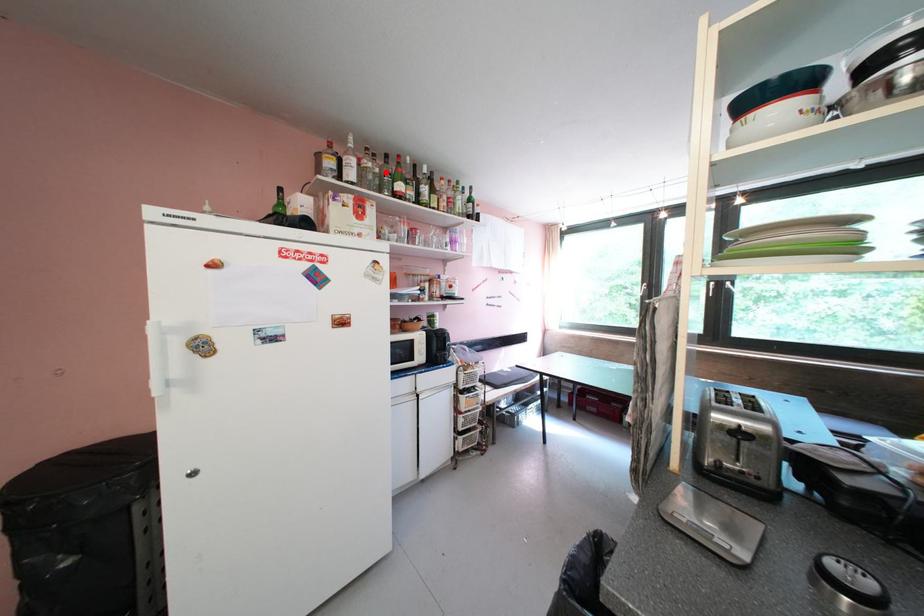
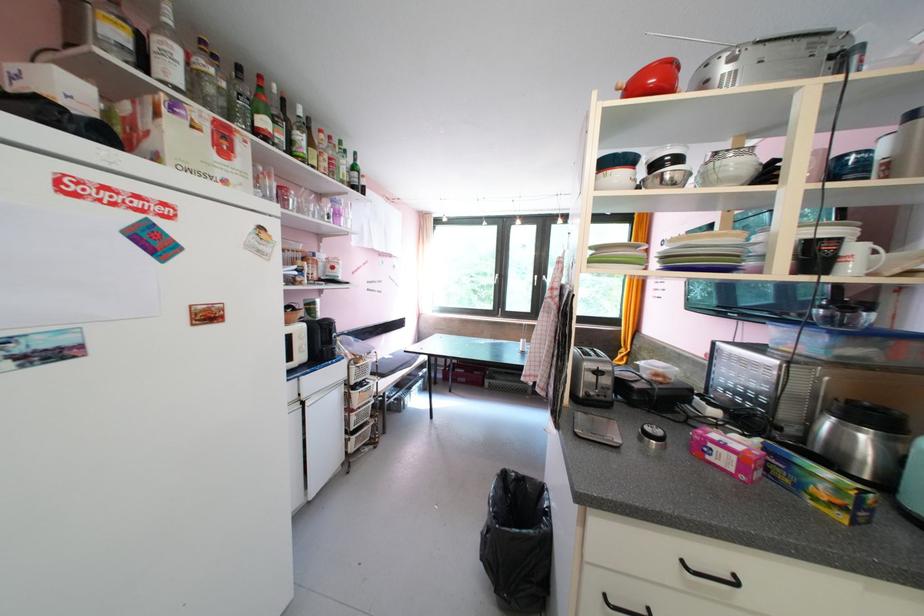
Find the pixel in the second image that matches the highlighted location in the first image.

(233, 86)